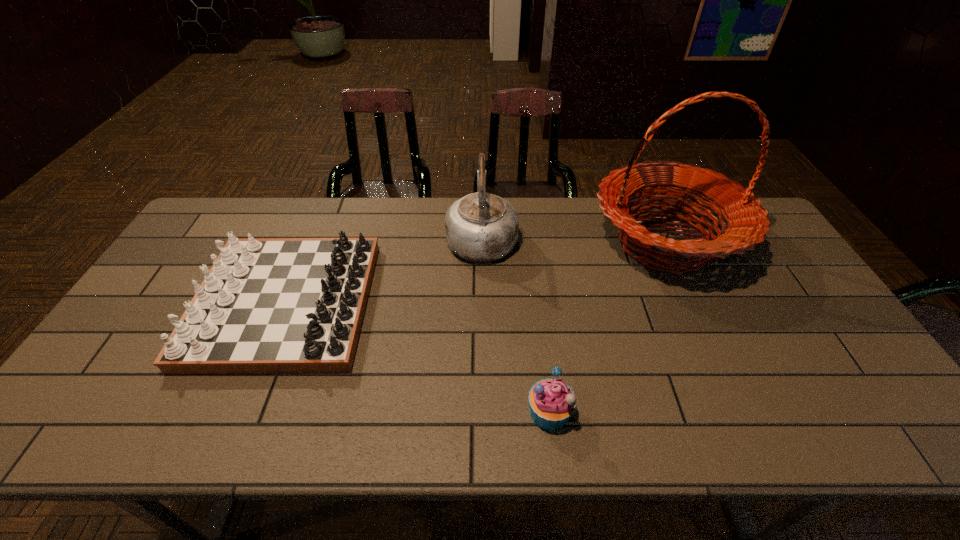
Where is `vacant area that lies between the leftmost object and the nearest object`? Image resolution: width=960 pixels, height=540 pixels. vacant area that lies between the leftmost object and the nearest object is located at coordinates (418, 358).

Identify which object is located as the nearest to the second tallest object. Please provide its 2D coordinates. Your answer should be formatted as a tuple, i.e. [(x, y)], where the tuple contains the x and y coordinates of a point satisfying the conditions above.

[(268, 305)]

At what (x,y) coordinates should I click in order to perform the action: click on the third closest object to the nearest object. Please return your answer as a coordinate pair (x, y). Looking at the image, I should click on (480, 227).

The width and height of the screenshot is (960, 540). Find the location of `vacant point that satisfies the following two spatial constraints: 1. on the front side of the muffin; 2. on the left side of the gameboard`. vacant point that satisfies the following two spatial constraints: 1. on the front side of the muffin; 2. on the left side of the gameboard is located at coordinates (241, 411).

Where is `free spot that satisfies the following two spatial constraints: 1. on the front side of the gameboard; 2. on the right side of the muffin`? This screenshot has height=540, width=960. free spot that satisfies the following two spatial constraints: 1. on the front side of the gameboard; 2. on the right side of the muffin is located at coordinates (241, 411).

Find the location of a particular element. This screenshot has width=960, height=540. free location that satisfies the following two spatial constraints: 1. on the back side of the muffin; 2. on the right side of the tallest object is located at coordinates (529, 243).